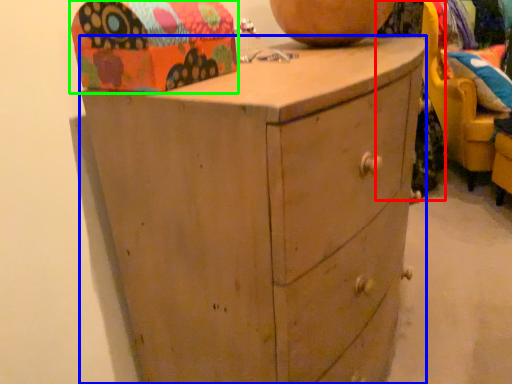
Question: Which is farther away from clothing (highlighted by a red box)? chest of drawers (highlighted by a blue box) or shoe box (highlighted by a green box)?

Choices:
 (A) chest of drawers
 (B) shoe box

Answer: (B)